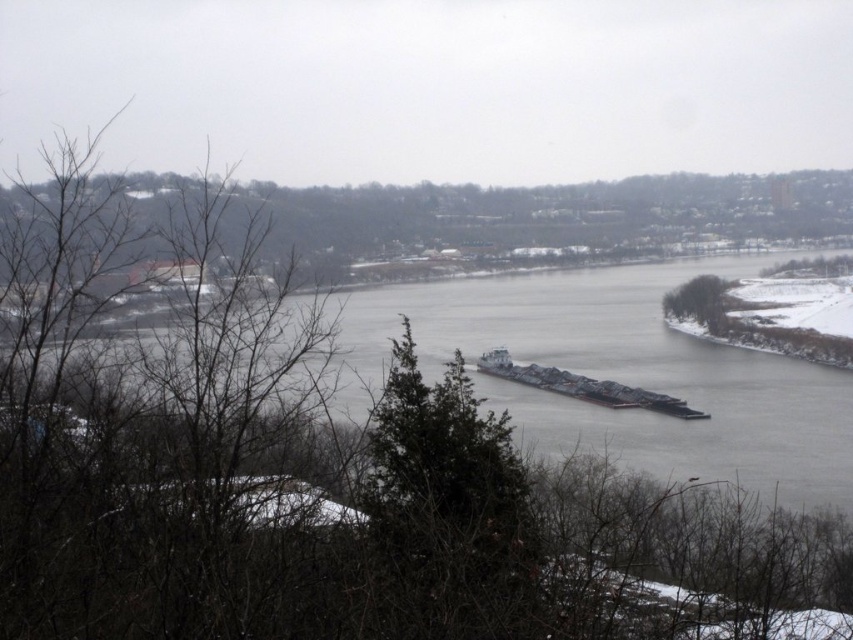
Question: Does dark gray metallic barge at center have a greater width compared to green leafy tree at right?

Choices:
 (A) no
 (B) yes

Answer: (B)

Question: Among these objects, which one is farthest from the camera?

Choices:
 (A) dark gray metallic barge at center
 (B) green leafy tree at right

Answer: (B)

Question: In this image, where is dark gray metallic barge at center located relative to green leafy tree at right?

Choices:
 (A) below
 (B) above

Answer: (A)

Question: Which of the following is the closest to the observer?

Choices:
 (A) click(682, 305)
 (B) click(535, 381)

Answer: (B)

Question: Is dark gray metallic barge at center to the left of green leafy tree at right from the viewer's perspective?

Choices:
 (A) yes
 (B) no

Answer: (A)